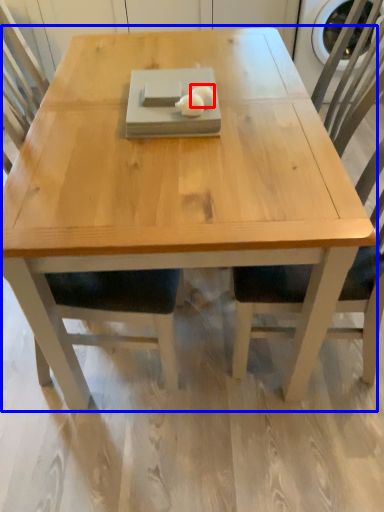
Question: Which of the following is the farthest to the observer, food (highlighted by a red box) or coffee table (highlighted by a blue box)?

Choices:
 (A) food
 (B) coffee table

Answer: (B)